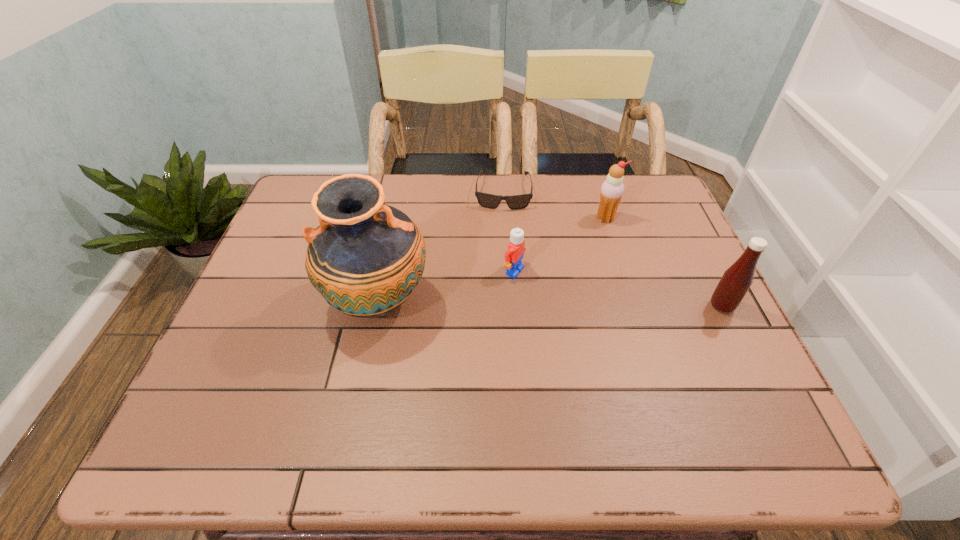
The height and width of the screenshot is (540, 960). I want to click on empty space that is in between the second farthest object and the Lego, so click(x=560, y=245).

Locate an element on the screen. The image size is (960, 540). vacant area between the leftmost object and the farthest object is located at coordinates (441, 246).

Identify the location of free area in between the second shortest object and the second farthest object. The height and width of the screenshot is (540, 960). (560, 245).

Where is `vacant point located between the farthest object and the Tabasco sauce`? vacant point located between the farthest object and the Tabasco sauce is located at coordinates (612, 248).

At what (x,y) coordinates should I click in order to perform the action: click on vacant area between the rightmost object and the second object from right to left. Please return your answer as a coordinate pair (x, y). The height and width of the screenshot is (540, 960). Looking at the image, I should click on (663, 262).

Identify the location of free spot between the tallest object and the rightmost object. (550, 303).

You are a GUI agent. You are given a task and a screenshot of the screen. Output one action in this format:
    pyautogui.click(x=<x>, y=<y>)
    Task: Click on the blank region between the second farthest object and the Tabasco sauce
    The height and width of the screenshot is (540, 960).
    Given the screenshot: What is the action you would take?
    pyautogui.click(x=663, y=262)

Where is `vacant space that's between the leftmost object and the Tabasco sauce`? The height and width of the screenshot is (540, 960). vacant space that's between the leftmost object and the Tabasco sauce is located at coordinates (550, 303).

In order to click on object that can be found as the second closest to the second shortest object in this screenshot , I will do `click(486, 200)`.

Image resolution: width=960 pixels, height=540 pixels. Identify the location of the third closest object to the shortest object. (366, 258).